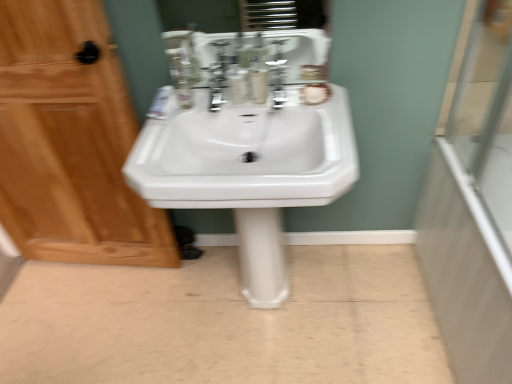
Question: From the image's perspective, is transparent glass shower door at right on white glossy pedestal sink at center?

Choices:
 (A) no
 (B) yes

Answer: (B)

Question: Does transparent glass shower door at right have a lesser height compared to white glossy pedestal sink at center?

Choices:
 (A) no
 (B) yes

Answer: (A)

Question: Can you confirm if transparent glass shower door at right is taller than white glossy pedestal sink at center?

Choices:
 (A) yes
 (B) no

Answer: (A)

Question: Can you confirm if transparent glass shower door at right is thinner than white glossy pedestal sink at center?

Choices:
 (A) no
 (B) yes

Answer: (B)

Question: Is transparent glass shower door at right facing towards white glossy pedestal sink at center?

Choices:
 (A) no
 (B) yes

Answer: (B)

Question: From a real-world perspective, is transparent glass shower door at right physically above white glossy pedestal sink at center?

Choices:
 (A) yes
 (B) no

Answer: (A)

Question: Is translucent plastic mouthwash at center, marked as the 2th mouthwash in a right-to-left arrangement, completely or partially inside white glossy pedestal sink at center?

Choices:
 (A) yes
 (B) no

Answer: (B)

Question: Considering the relative positions of white glossy pedestal sink at center and translucent plastic mouthwash at center, positioned as the first mouthwash in left-to-right order, in the image provided, is white glossy pedestal sink at center in front of translucent plastic mouthwash at center, positioned as the first mouthwash in left-to-right order,?

Choices:
 (A) yes
 (B) no

Answer: (B)

Question: Considering the relative sizes of white glossy pedestal sink at center and translucent plastic mouthwash at center, marked as the 2th mouthwash in a right-to-left arrangement, in the image provided, is white glossy pedestal sink at center taller than translucent plastic mouthwash at center, marked as the 2th mouthwash in a right-to-left arrangement,?

Choices:
 (A) no
 (B) yes

Answer: (A)

Question: Would you consider white glossy pedestal sink at center to be distant from translucent plastic mouthwash at center, marked as the 2th mouthwash in a right-to-left arrangement?

Choices:
 (A) yes
 (B) no

Answer: (B)

Question: Is white glossy pedestal sink at center not inside translucent plastic mouthwash at center, positioned as the first mouthwash in left-to-right order?

Choices:
 (A) no
 (B) yes

Answer: (B)

Question: Is white glossy pedestal sink at center to the left of translucent plastic mouthwash at center, positioned as the first mouthwash in left-to-right order, from the viewer's perspective?

Choices:
 (A) yes
 (B) no

Answer: (A)

Question: Is transparent glass door at right bigger than white glossy pedestal sink at center?

Choices:
 (A) yes
 (B) no

Answer: (B)